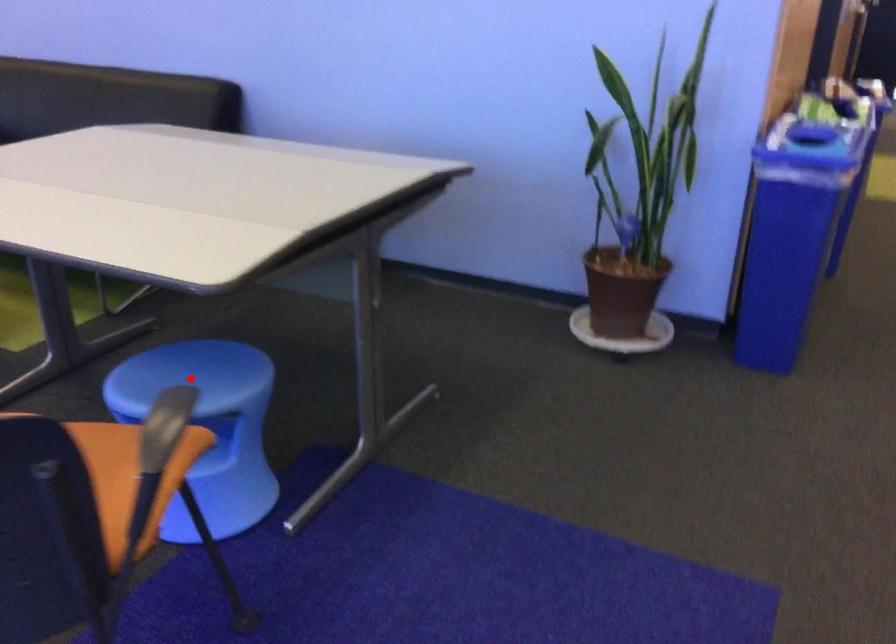
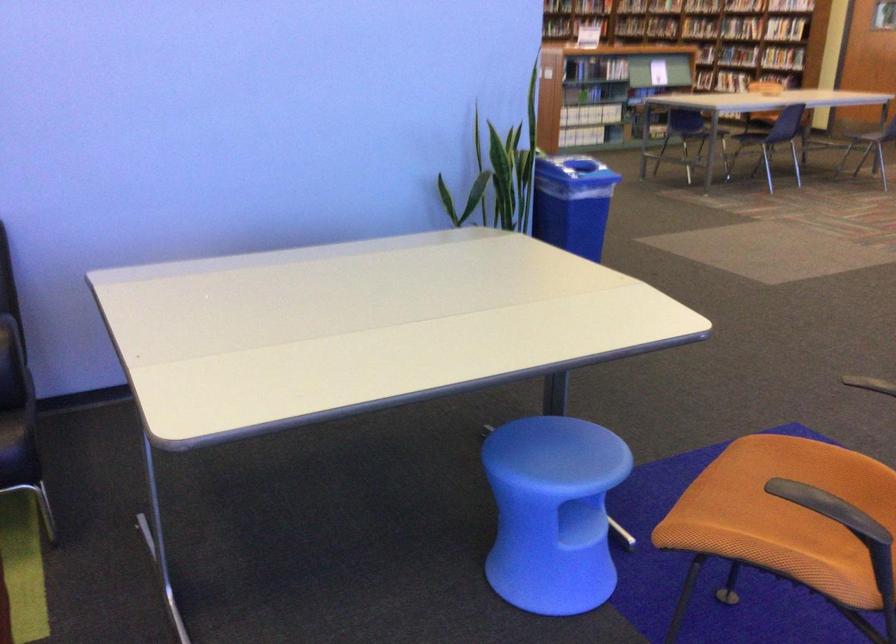
In the second image, find the point that corresponds to the highlighted location in the first image.

(560, 453)